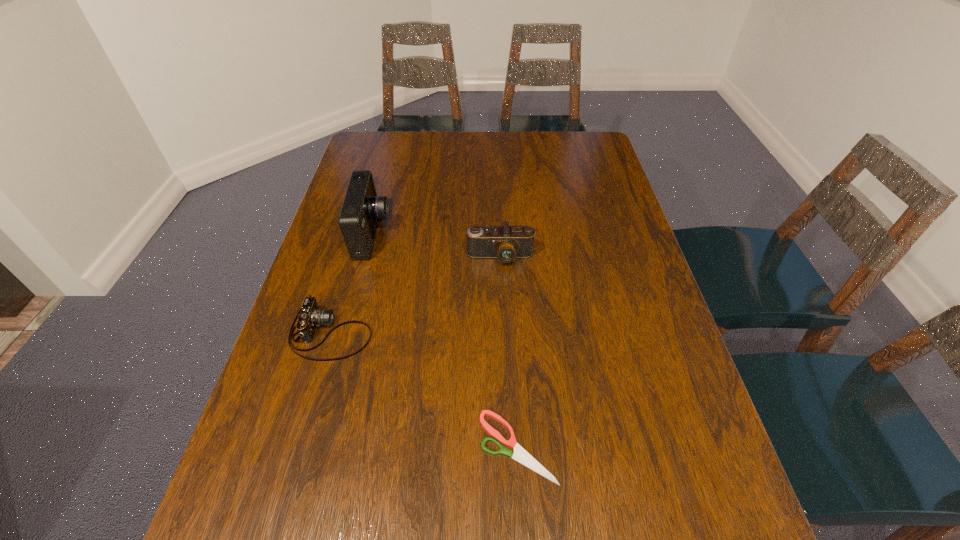
Identify the location of free location that satisfies the following two spatial constraints: 1. on the front-facing side of the tallest object; 2. on the back side of the scissors. (317, 447).

Where is `vacant space that satisfies the following two spatial constraints: 1. on the lens of the rightmost camera; 2. on the right side of the shortest object`? The height and width of the screenshot is (540, 960). vacant space that satisfies the following two spatial constraints: 1. on the lens of the rightmost camera; 2. on the right side of the shortest object is located at coordinates (509, 447).

Where is `blank area in the image that satisfies the following two spatial constraints: 1. on the lens of the scissors; 2. on the left side of the rightmost camera`? The width and height of the screenshot is (960, 540). blank area in the image that satisfies the following two spatial constraints: 1. on the lens of the scissors; 2. on the left side of the rightmost camera is located at coordinates (509, 447).

What are the coordinates of `free location that satisfies the following two spatial constraints: 1. on the lens of the second tallest camera; 2. on the left side of the scissors` in the screenshot? It's located at (509, 447).

The width and height of the screenshot is (960, 540). I want to click on free space that satisfies the following two spatial constraints: 1. on the lens of the second tallest camera; 2. on the right side of the nearest object, so click(x=509, y=447).

At what (x,y) coordinates should I click in order to perform the action: click on free spot that satisfies the following two spatial constraints: 1. on the lens of the second tallest camera; 2. on the front-facing side of the third tallest object. Please return your answer as a coordinate pair (x, y). The height and width of the screenshot is (540, 960). Looking at the image, I should click on (503, 333).

Where is `free space that satisfies the following two spatial constraints: 1. on the front-facing side of the tallest camera; 2. on the back side of the scissors`? free space that satisfies the following two spatial constraints: 1. on the front-facing side of the tallest camera; 2. on the back side of the scissors is located at coordinates (317, 447).